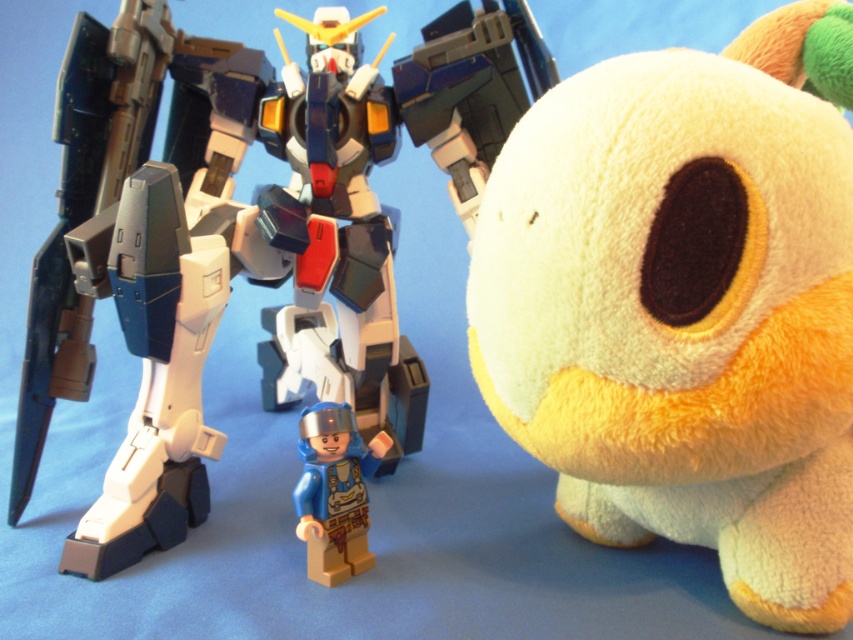
Does yellow plush toy at center have a greater height compared to plastic/smooth robot at center?

Yes, yellow plush toy at center is taller than plastic/smooth robot at center.

Does yellow plush toy at center appear on the left side of plastic/smooth robot at center?

No, yellow plush toy at center is not to the left of plastic/smooth robot at center.

Is point (769, 545) in front of point (473, 90)?

Yes, it is in front of point (473, 90).

This screenshot has height=640, width=853. Find the location of `yellow plush toy at center`. yellow plush toy at center is located at coordinates (683, 310).

Who is more distant from viewer, (x=654, y=64) or (x=305, y=524)?

Point (x=305, y=524)

Does yellow plush toy at center have a smaller size compared to blue plastic minifigure at center?

No.

Is point (614, 288) positioned before point (311, 561)?

Yes, point (614, 288) is closer to viewer.

I want to click on yellow plush toy at center, so click(683, 310).

Does yellow plush toy at center have a lesser height compared to shiny plastic robot at center?

Yes.

Is point (618, 122) positioned behind point (399, 417)?

No, (618, 122) is closer to viewer.

At what (x,y) coordinates should I click in order to perform the action: click on yellow plush toy at center. Please return your answer as a coordinate pair (x, y). Looking at the image, I should click on coord(683,310).